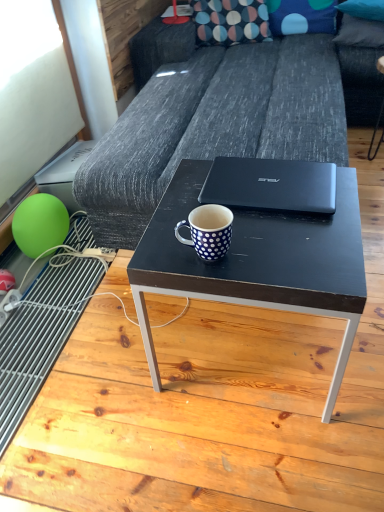
Identify the location of free location in front of black matte laptop at center. (286, 246).